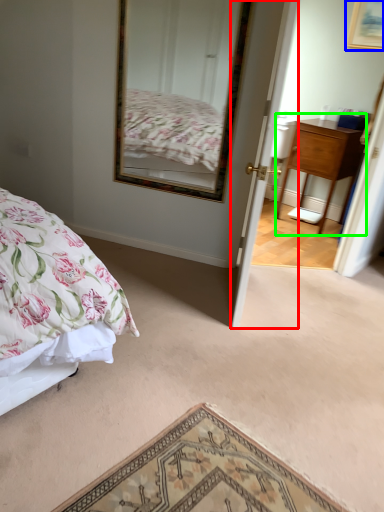
Question: Considering the real-world distances, which object is farthest from door (highlighted by a red box)? picture frame (highlighted by a blue box) or nightstand (highlighted by a green box)?

Choices:
 (A) picture frame
 (B) nightstand

Answer: (A)